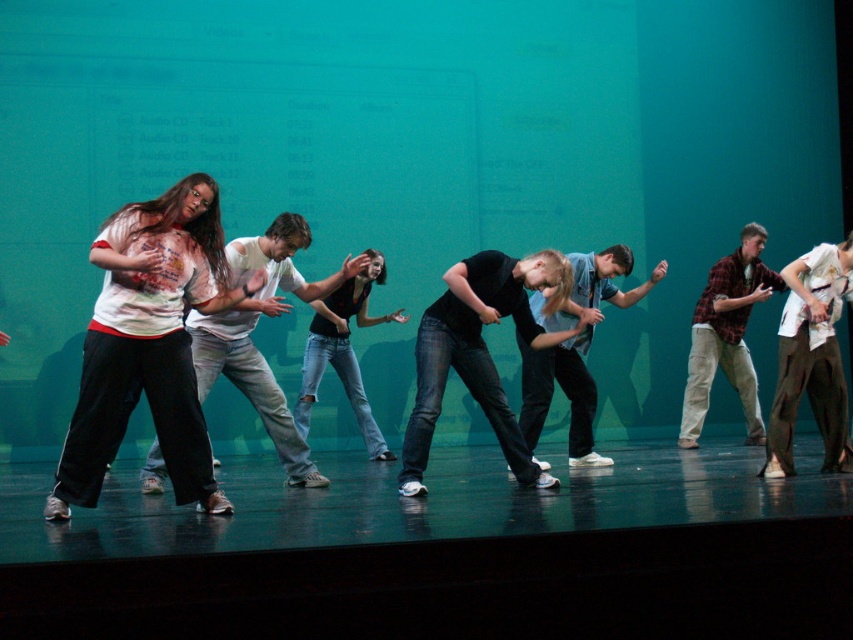
Question: Which object appears closest to the camera in this image?

Choices:
 (A) plaid flannel shirt at center
 (B) light blue shirt at center

Answer: (B)

Question: Does matte white shirt at left have a larger size compared to white cotton shirt at center?

Choices:
 (A) no
 (B) yes

Answer: (A)

Question: Which is nearer to the white cotton shirt at center?

Choices:
 (A) plaid flannel shirt at center
 (B) light blue shirt at center

Answer: (B)

Question: Which of the following is the closest to the observer?

Choices:
 (A) plaid flannel shirt at center
 (B) white cotton shirt at center

Answer: (B)

Question: Does matte white shirt at left appear under light blue shirt at center?

Choices:
 (A) no
 (B) yes

Answer: (A)

Question: Can you confirm if white cotton shirt at center is bigger than plaid flannel shirt at center?

Choices:
 (A) no
 (B) yes

Answer: (B)